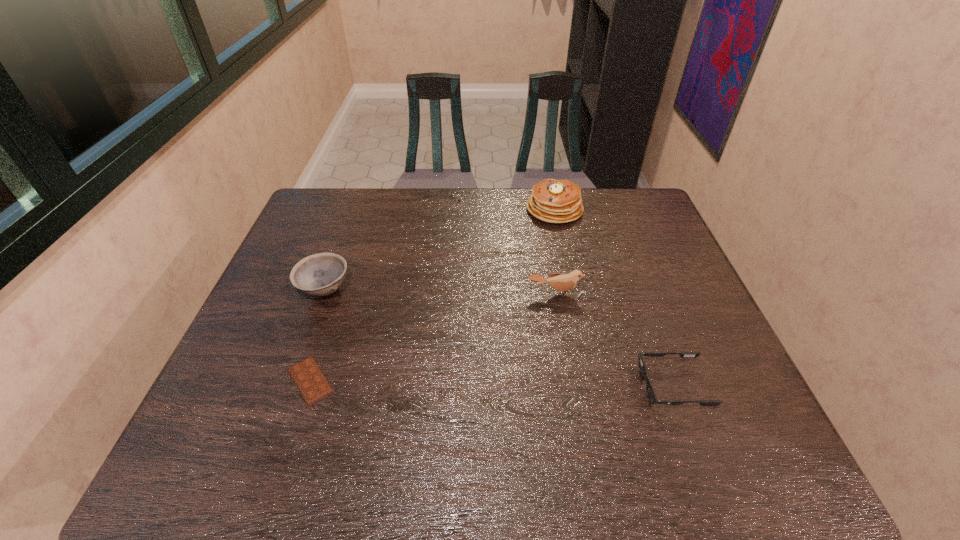
This screenshot has height=540, width=960. In order to click on vacant space located on the temples of the sunglasses in this screenshot , I will do `click(583, 386)`.

The width and height of the screenshot is (960, 540). In order to click on vacant space located on the temples of the sunglasses in this screenshot , I will do `click(516, 386)`.

This screenshot has width=960, height=540. What are the coordinates of `free region located on the back of the shortest object` in the screenshot? It's located at (347, 271).

Image resolution: width=960 pixels, height=540 pixels. I want to click on object located in the far edge section of the desktop, so click(553, 201).

Where is `bowl that is at the left edge`? bowl that is at the left edge is located at coordinates (321, 274).

Find the location of a particular element. chocolate bar that is at the left edge is located at coordinates (309, 379).

In order to click on object positioned at the right edge in this screenshot , I will do `click(651, 395)`.

Find the location of `vacant area at the far edge of the desktop`. vacant area at the far edge of the desktop is located at coordinates (525, 194).

Where is `blank space at the near edge of the desktop`? blank space at the near edge of the desktop is located at coordinates (439, 440).

Locate an element on the screen. Image resolution: width=960 pixels, height=540 pixels. free space at the left edge is located at coordinates [x=260, y=317].